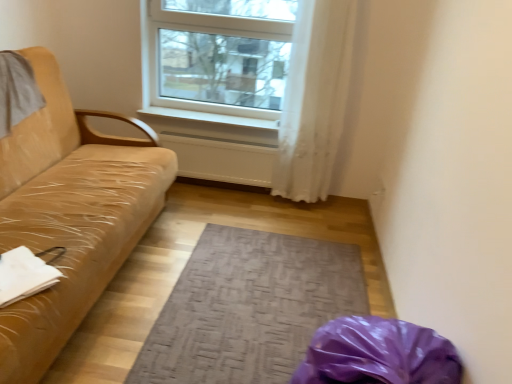
Question: Is white smooth window sill at center far away from textured gray mat at center?

Choices:
 (A) yes
 (B) no

Answer: (A)

Question: Is white smooth window sill at center touching textured gray mat at center?

Choices:
 (A) no
 (B) yes

Answer: (A)

Question: Is white smooth window sill at center smaller than textured gray mat at center?

Choices:
 (A) no
 (B) yes

Answer: (B)

Question: From the image's perspective, does white smooth window sill at center appear lower than textured gray mat at center?

Choices:
 (A) yes
 (B) no

Answer: (B)

Question: Is white smooth window sill at center thinner than textured gray mat at center?

Choices:
 (A) yes
 (B) no

Answer: (A)

Question: From their relative heights in the image, would you say white smooth window sill at center is taller or shorter than white plastic window at upper center?

Choices:
 (A) tall
 (B) short

Answer: (B)

Question: Would you say white smooth window sill at center is inside or outside white plastic window at upper center?

Choices:
 (A) inside
 (B) outside

Answer: (B)

Question: From the image's perspective, relative to white plastic window at upper center, is white smooth window sill at center above or below?

Choices:
 (A) below
 (B) above

Answer: (A)

Question: From a real-world perspective, is white smooth window sill at center above or below white plastic window at upper center?

Choices:
 (A) below
 (B) above

Answer: (A)

Question: From a real-world perspective, is white sheer curtain at upper center above or below white smooth window sill at center?

Choices:
 (A) above
 (B) below

Answer: (A)

Question: In terms of width, does white sheer curtain at upper center look wider or thinner when compared to white smooth window sill at center?

Choices:
 (A) thin
 (B) wide

Answer: (A)

Question: In terms of height, does white sheer curtain at upper center look taller or shorter compared to white smooth window sill at center?

Choices:
 (A) short
 (B) tall

Answer: (B)

Question: Is point (301, 175) positioned closer to the camera than point (225, 119)?

Choices:
 (A) closer
 (B) farther

Answer: (A)

Question: Visually, is textured gray mat at center positioned to the left or to the right of white plastic window at upper center?

Choices:
 (A) right
 (B) left

Answer: (A)

Question: Considering the positions of textured gray mat at center and white plastic window at upper center in the image, is textured gray mat at center wider or thinner than white plastic window at upper center?

Choices:
 (A) thin
 (B) wide

Answer: (B)